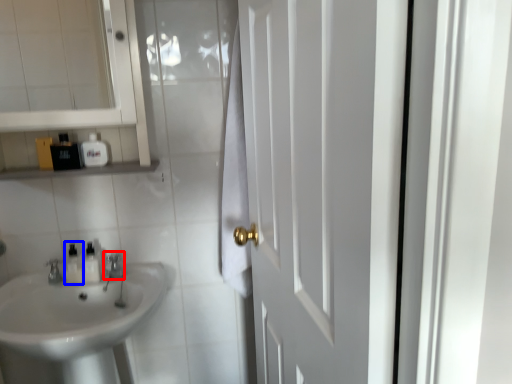
Question: Which object is closer to the camera taking this photo, faucet (highlighted by a red box) or toiletry (highlighted by a blue box)?

Choices:
 (A) faucet
 (B) toiletry

Answer: (A)